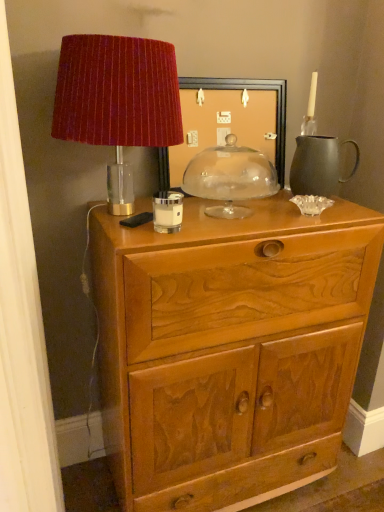
The width and height of the screenshot is (384, 512). I want to click on free location above wooden carved chest of drawers at center (from a real-world perspective), so click(x=240, y=207).